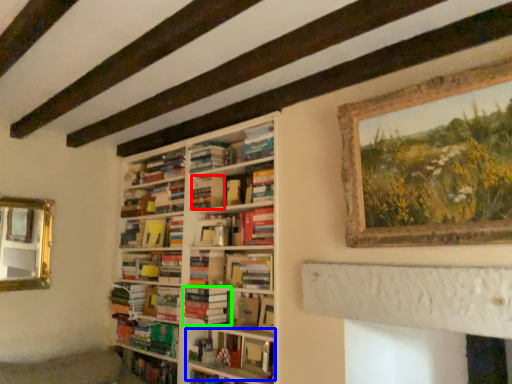
Question: Considering the real-world distances, which object is closest to paperback book (highlighted by a red box)? book (highlighted by a blue box) or book (highlighted by a green box).

Choices:
 (A) book
 (B) book

Answer: (B)